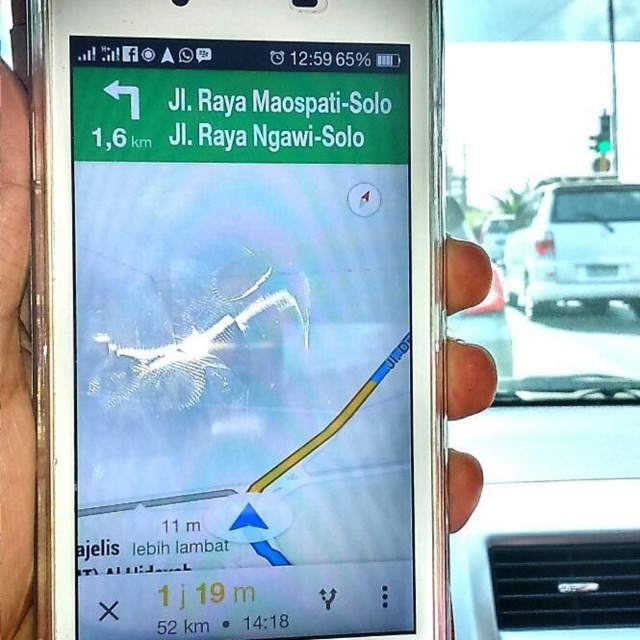
Question: Can you confirm if metallic at right is bigger than white matte van at center?

Choices:
 (A) no
 (B) yes

Answer: (A)

Question: Estimate the real-world distances between objects in this image. Which object is farther from the white matte car at right?

Choices:
 (A) green matte navigation screen at upper center
 (B) metallic at right
 (C) brown leather hand at upper left
 (D) white matte van at center

Answer: (C)

Question: From the image, what is the correct spatial relationship of metallic at right in relation to white matte van at center?

Choices:
 (A) left
 (B) right

Answer: (A)

Question: Does green matte navigation screen at upper center have a lesser width compared to white matte van at center?

Choices:
 (A) no
 (B) yes

Answer: (A)

Question: Which point is farther from the camera taking this photo?

Choices:
 (A) (493, 250)
 (B) (465, 381)
 (C) (513, 284)
 (D) (282, 72)

Answer: (A)

Question: Which is farther from the brown leather hand at upper left?

Choices:
 (A) green matte navigation screen at upper center
 (B) metallic at right
 (C) white matte car at right
 (D) white matte van at center

Answer: (C)